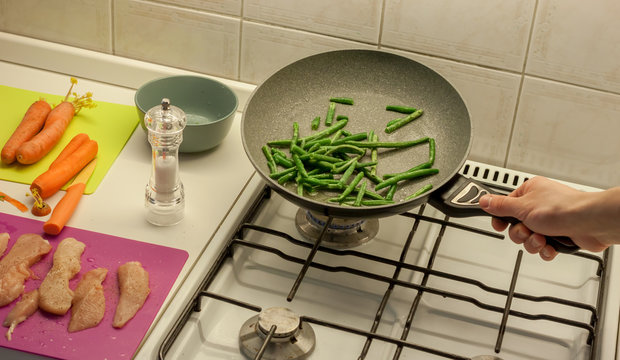
At what (x,y) coordinates should I click in order to perform the action: click on counter. Please return your answer as a coordinate pair (x, y). The height and width of the screenshot is (360, 620). Looking at the image, I should click on (118, 201).